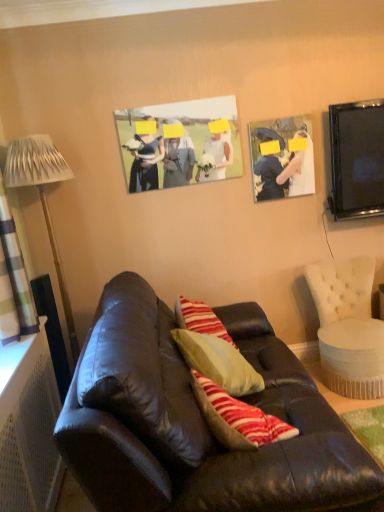
Question: Should I look upward or downward to see metallic silver lamp at left?

Choices:
 (A) down
 (B) up

Answer: (A)

Question: Considering the relative positions of matte black couch at center and black glossy tv at upper right in the image provided, is matte black couch at center to the left of black glossy tv at upper right from the viewer's perspective?

Choices:
 (A) no
 (B) yes

Answer: (B)

Question: Considering the relative positions of matte black couch at center and black glossy tv at upper right in the image provided, is matte black couch at center to the right of black glossy tv at upper right from the viewer's perspective?

Choices:
 (A) no
 (B) yes

Answer: (A)

Question: Is matte black couch at center smaller than black glossy tv at upper right?

Choices:
 (A) yes
 (B) no

Answer: (B)

Question: Is black glossy tv at upper right at the back of matte black couch at center?

Choices:
 (A) yes
 (B) no

Answer: (B)

Question: Considering the relative sizes of matte black couch at center and black glossy tv at upper right in the image provided, is matte black couch at center bigger than black glossy tv at upper right?

Choices:
 (A) no
 (B) yes

Answer: (B)

Question: Can you confirm if matte black couch at center is taller than black glossy tv at upper right?

Choices:
 (A) no
 (B) yes

Answer: (B)

Question: From the image's perspective, would you say plaid fabric curtain at left is shown under black glossy tv at upper right?

Choices:
 (A) yes
 (B) no

Answer: (A)

Question: Does plaid fabric curtain at left have a smaller size compared to black glossy tv at upper right?

Choices:
 (A) no
 (B) yes

Answer: (A)

Question: Is plaid fabric curtain at left thinner than black glossy tv at upper right?

Choices:
 (A) no
 (B) yes

Answer: (A)

Question: Is plaid fabric curtain at left directly adjacent to black glossy tv at upper right?

Choices:
 (A) no
 (B) yes

Answer: (A)

Question: Is plaid fabric curtain at left not close to black glossy tv at upper right?

Choices:
 (A) no
 (B) yes

Answer: (B)

Question: Can you confirm if plaid fabric curtain at left is positioned to the left of black glossy tv at upper right?

Choices:
 (A) yes
 (B) no

Answer: (A)

Question: Is plaid fabric curtain at left closer to the viewer compared to matte black photo frame at upper right, arranged as the 1th picture frame when viewed from the right?

Choices:
 (A) yes
 (B) no

Answer: (A)